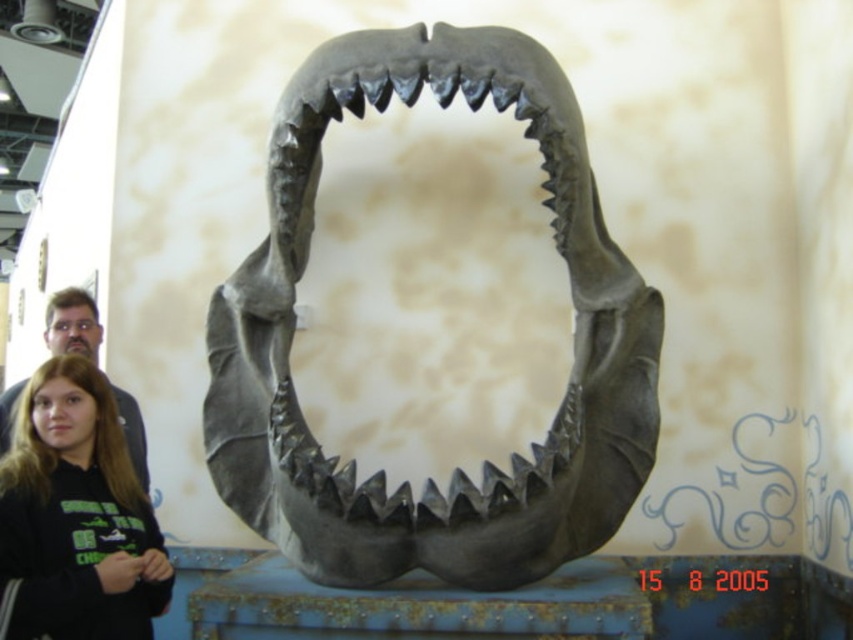
Based on the photo, does matte black hair at lower left come in front of matte gray teeth at center?

That is False.

Can you confirm if matte black hair at lower left is taller than matte gray teeth at center?

Correct, matte black hair at lower left is much taller as matte gray teeth at center.

Find the location of a particular element. The width and height of the screenshot is (853, 640). matte black hair at lower left is located at coordinates click(x=73, y=323).

This screenshot has width=853, height=640. I want to click on matte black hair at lower left, so click(x=73, y=323).

Does gray metallic shark jaw at center have a smaller size compared to black hoodie at lower left?

No.

Measure the distance between gray metallic shark jaw at center and camera.

gray metallic shark jaw at center and camera are 4.63 meters apart from each other.

Is point (271, 483) behind point (106, 532)?

That is True.

Locate an element on the screen. Image resolution: width=853 pixels, height=640 pixels. gray metallic shark jaw at center is located at coordinates (457, 467).

Who is more distant from viewer, (570,288) or (73,432)?

The point (570,288) is more distant.

Is gray metallic shark jaw at center taller than matte gray teeth at center?

Correct, gray metallic shark jaw at center is much taller as matte gray teeth at center.

Image resolution: width=853 pixels, height=640 pixels. Find the location of `gray metallic shark jaw at center`. gray metallic shark jaw at center is located at coordinates (457, 467).